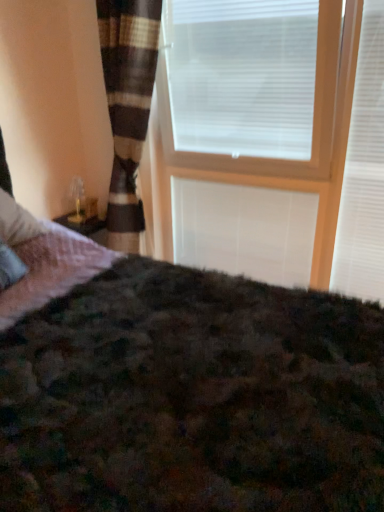
Question: Which direction should I rotate to look at white plastic blinds at upper center, which is the first window blind from left to right, — up or down?

Choices:
 (A) down
 (B) up

Answer: (B)

Question: Does white matte blind at center lie in front of white matte window blind at upper right, which ranks as the 2th window blind in left-to-right order?

Choices:
 (A) yes
 (B) no

Answer: (B)

Question: From the image's perspective, is white matte blind at center above white matte window blind at upper right, placed as the first window blind when sorted from right to left?

Choices:
 (A) no
 (B) yes

Answer: (A)

Question: From the image's perspective, is white matte blind at center below white matte window blind at upper right, which ranks as the 2th window blind in left-to-right order?

Choices:
 (A) yes
 (B) no

Answer: (A)

Question: From a real-world perspective, is white matte blind at center positioned under white matte window blind at upper right, placed as the first window blind when sorted from right to left, based on gravity?

Choices:
 (A) yes
 (B) no

Answer: (A)

Question: Can you confirm if white matte blind at center is thinner than white matte window blind at upper right, placed as the first window blind when sorted from right to left?

Choices:
 (A) no
 (B) yes

Answer: (B)

Question: Is white matte blind at center touching white matte window blind at upper right, which ranks as the 2th window blind in left-to-right order?

Choices:
 (A) no
 (B) yes

Answer: (A)

Question: Considering the relative sizes of white plastic blinds at upper center, the 2th window blind viewed from the right, and white matte window blind at upper right, which ranks as the 2th window blind in left-to-right order, in the image provided, is white plastic blinds at upper center, the 2th window blind viewed from the right, taller than white matte window blind at upper right, which ranks as the 2th window blind in left-to-right order,?

Choices:
 (A) no
 (B) yes

Answer: (A)

Question: Is white plastic blinds at upper center, the 2th window blind viewed from the right, closer to camera compared to white matte window blind at upper right, which ranks as the 2th window blind in left-to-right order?

Choices:
 (A) no
 (B) yes

Answer: (A)

Question: Does white plastic blinds at upper center, the 2th window blind viewed from the right, come behind white matte window blind at upper right, which ranks as the 2th window blind in left-to-right order?

Choices:
 (A) yes
 (B) no

Answer: (A)

Question: Considering the relative sizes of white plastic blinds at upper center, which is the first window blind from left to right, and white matte window blind at upper right, placed as the first window blind when sorted from right to left, in the image provided, is white plastic blinds at upper center, which is the first window blind from left to right, thinner than white matte window blind at upper right, placed as the first window blind when sorted from right to left,?

Choices:
 (A) yes
 (B) no

Answer: (B)

Question: Is white plastic blinds at upper center, which is the first window blind from left to right, not inside white matte window blind at upper right, which ranks as the 2th window blind in left-to-right order?

Choices:
 (A) no
 (B) yes

Answer: (B)

Question: Can you confirm if white plastic blinds at upper center, the 2th window blind viewed from the right, is bigger than white matte window blind at upper right, which ranks as the 2th window blind in left-to-right order?

Choices:
 (A) yes
 (B) no

Answer: (A)

Question: Can we say wooden frame at upper center lies outside white matte window blind at upper right, placed as the first window blind when sorted from right to left?

Choices:
 (A) no
 (B) yes

Answer: (B)